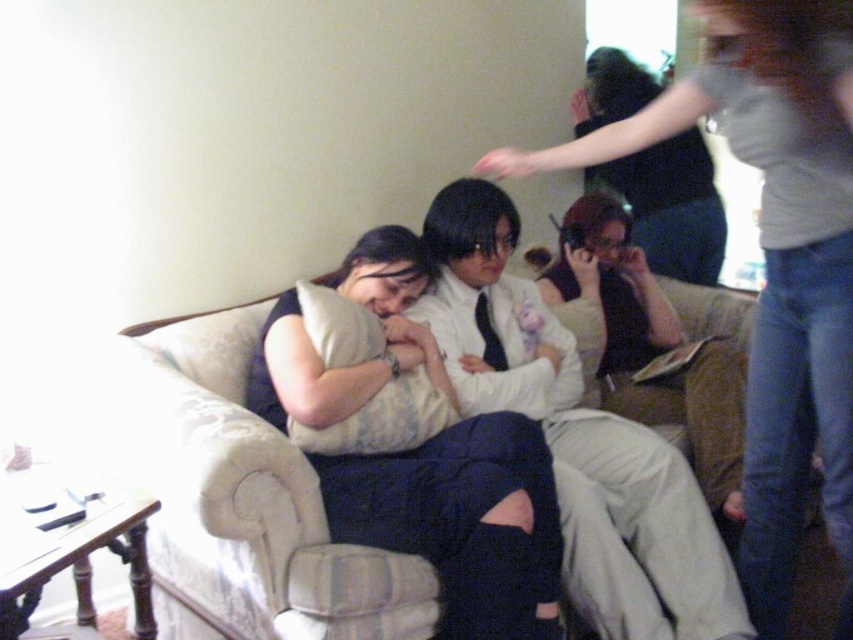
Question: Which of the following is the closest to the observer?

Choices:
 (A) pyautogui.click(x=764, y=456)
 (B) pyautogui.click(x=490, y=420)
 (C) pyautogui.click(x=93, y=419)

Answer: (A)

Question: Among these objects, which one is nearest to the camera?

Choices:
 (A) beige fabric couch at center
 (B) matte black shirt at center

Answer: (A)

Question: Which of the following is the farthest from the observer?

Choices:
 (A) (193, 618)
 (B) (262, 408)

Answer: (B)

Question: Can you confirm if matte white shirt at upper right is bigger than white soft pillow at center?

Choices:
 (A) yes
 (B) no

Answer: (A)

Question: Is matte white shirt at upper right positioned before white soft pillow at center?

Choices:
 (A) yes
 (B) no

Answer: (A)

Question: Can you confirm if matte white shirt at upper right is positioned to the right of white soft pillow at center?

Choices:
 (A) no
 (B) yes

Answer: (B)